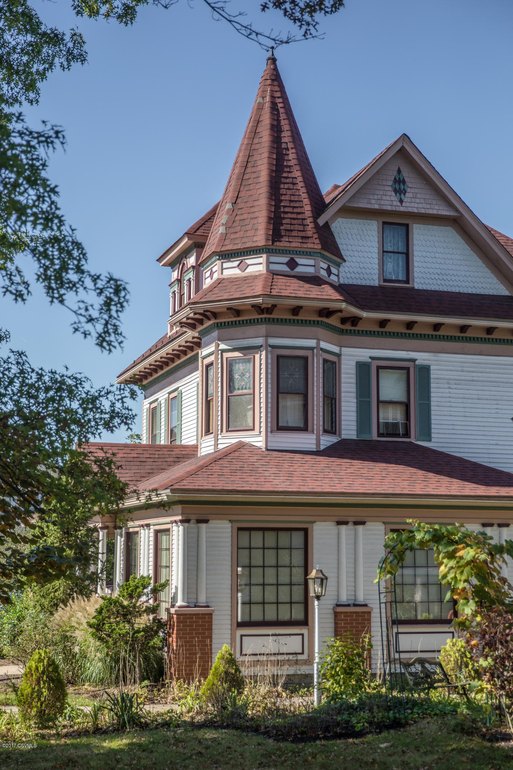
Where is `red brick pillar`? red brick pillar is located at coordinates (190, 631).